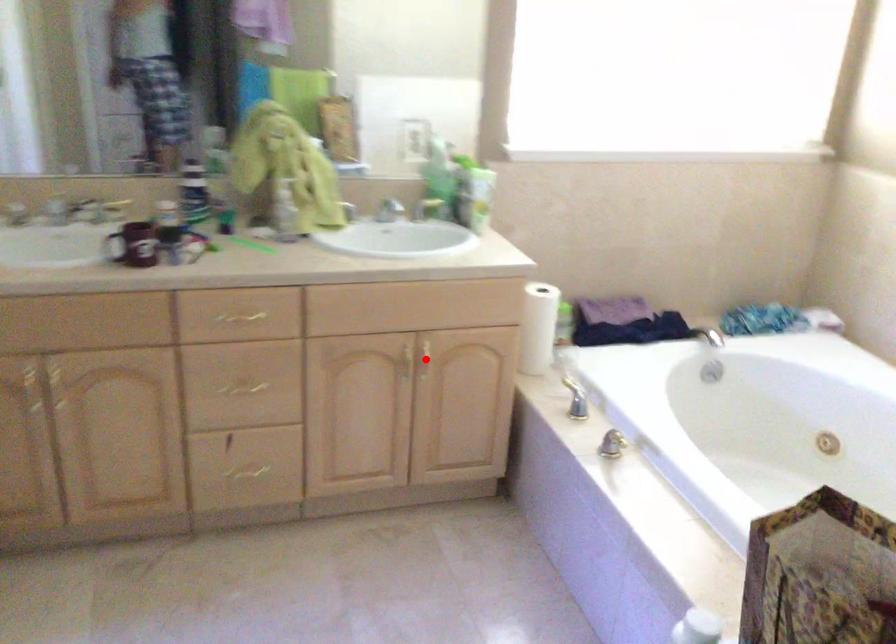
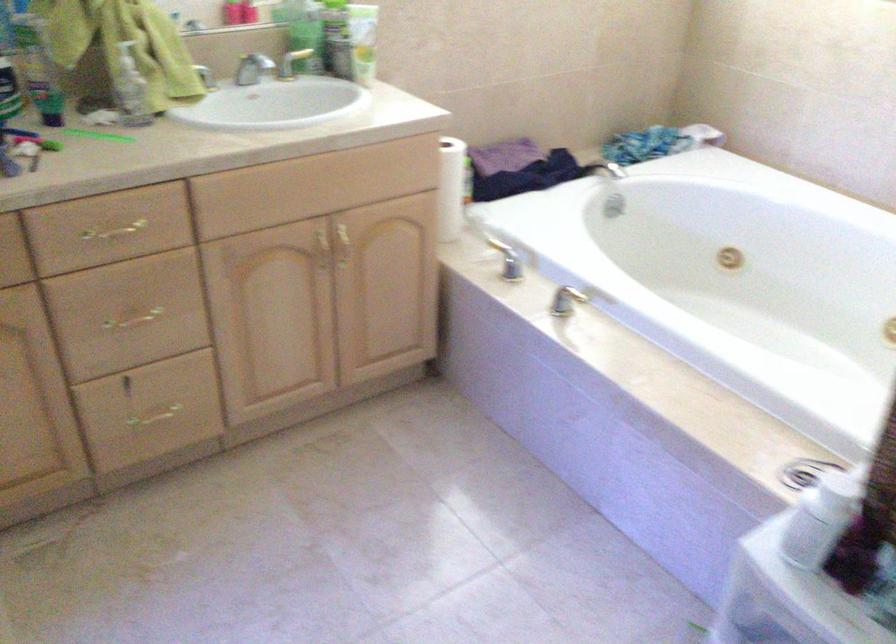
The point at the highlighted location is marked in the first image. Where is the corresponding point in the second image?

(342, 245)